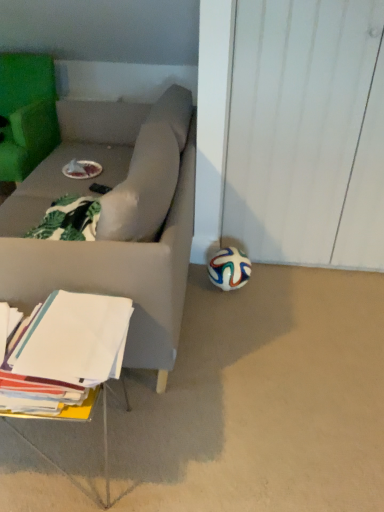
Describe the element at coordinates (261, 400) in the screenshot. I see `white matte soccer ball at lower right` at that location.

The width and height of the screenshot is (384, 512). Describe the element at coordinates (229, 269) in the screenshot. I see `multicolored rubber ball at lower right` at that location.

The width and height of the screenshot is (384, 512). What are the coordinates of `green fabric chair at upper left` in the screenshot? It's located at (26, 113).

Describe the element at coordinates (66, 357) in the screenshot. This screenshot has height=512, width=384. I see `white paper at lower left` at that location.

Locate an element on the screen. The width and height of the screenshot is (384, 512). white matte soccer ball at lower right is located at coordinates (261, 400).

Is the surface of green fabric chair at upper left in direct contact with multicolored rubber ball at lower right?

No, green fabric chair at upper left is not touching multicolored rubber ball at lower right.

Is green fabric chair at upper left wider or thinner than multicolored rubber ball at lower right?

In the image, green fabric chair at upper left appears to be wider than multicolored rubber ball at lower right.

Considering the positions of point (15, 111) and point (210, 264), is point (15, 111) closer or farther from the camera than point (210, 264)?

Point (15, 111) appears to be farther away from the viewer than point (210, 264).

From the image's perspective, is green fabric chair at upper left located above or below multicolored rubber ball at lower right?

green fabric chair at upper left is above multicolored rubber ball at lower right.

Is multicolored rubber ball at lower right placed right next to green fabric chair at upper left?

No, multicolored rubber ball at lower right is not touching green fabric chair at upper left.

Is multicolored rubber ball at lower right smaller than green fabric chair at upper left?

Yes, multicolored rubber ball at lower right is smaller than green fabric chair at upper left.

From their relative heights in the image, would you say multicolored rubber ball at lower right is taller or shorter than green fabric chair at upper left?

In the image, multicolored rubber ball at lower right appears to be shorter than green fabric chair at upper left.

This screenshot has width=384, height=512. What are the coordinates of `chair above the multicolored rubber ball at lower right (from a real-world perspective)` in the screenshot? It's located at (26, 113).

Would you say multicolored rubber ball at lower right is a long distance from white matte soccer ball at lower right?

No, multicolored rubber ball at lower right is in close proximity to white matte soccer ball at lower right.

Does multicolored rubber ball at lower right lie in front of white matte soccer ball at lower right?

No, multicolored rubber ball at lower right is behind white matte soccer ball at lower right.

Is multicolored rubber ball at lower right located outside white matte soccer ball at lower right?

Absolutely, multicolored rubber ball at lower right is external to white matte soccer ball at lower right.

Who is bigger, multicolored rubber ball at lower right or white matte soccer ball at lower right?

white matte soccer ball at lower right.

I want to click on ball on the right of the white paper at lower left, so click(x=229, y=269).

Based on the photo, considering the sizes of objects white paper at lower left and multicolored rubber ball at lower right in the image provided, who is shorter, white paper at lower left or multicolored rubber ball at lower right?

With less height is multicolored rubber ball at lower right.

Would you say white paper at lower left is outside multicolored rubber ball at lower right?

Yes, white paper at lower left is not within multicolored rubber ball at lower right.

Considering the points (30, 335) and (222, 256), which point is in front, point (30, 335) or point (222, 256)?

Point (30, 335)

From the image's perspective, between green fabric chair at upper left and white matte soccer ball at lower right, which one is located above?

green fabric chair at upper left.

Is green fabric chair at upper left located outside white matte soccer ball at lower right?

Indeed, green fabric chair at upper left is completely outside white matte soccer ball at lower right.

Does point (33, 102) appear closer or farther from the camera than point (68, 432)?

Point (33, 102) appears to be farther away from the viewer than point (68, 432).

From a real-world perspective, who is located lower, white paper at lower left or green fabric chair at upper left?

white paper at lower left.

Is white paper at lower left shorter than green fabric chair at upper left?

Yes, white paper at lower left is shorter than green fabric chair at upper left.

Is white paper at lower left wider than green fabric chair at upper left?

In fact, white paper at lower left might be narrower than green fabric chair at upper left.

From the picture: Is white matte soccer ball at lower right to the left of white paper at lower left from the viewer's perspective?

No, white matte soccer ball at lower right is not to the left of white paper at lower left.

Are white matte soccer ball at lower right and white paper at lower left beside each other?

No, white matte soccer ball at lower right is not making contact with white paper at lower left.

Can you confirm if white matte soccer ball at lower right is wider than white paper at lower left?

Indeed, white matte soccer ball at lower right has a greater width compared to white paper at lower left.

Find the location of a particular element. ball below the green fabric chair at upper left (from a real-world perspective) is located at coordinates (229, 269).

Where is `chair that is behind the multicolored rubber ball at lower right`? Image resolution: width=384 pixels, height=512 pixels. chair that is behind the multicolored rubber ball at lower right is located at coordinates (26, 113).

Based on their spatial positions, is white matte soccer ball at lower right or white paper at lower left closer to multicolored rubber ball at lower right?

The object closer to multicolored rubber ball at lower right is white matte soccer ball at lower right.

Based on the photo, estimate the real-world distances between objects in this image. Which object is closer to multicolored rubber ball at lower right, white paper at lower left or white matte soccer ball at lower right?

Based on the image, white matte soccer ball at lower right appears to be nearer to multicolored rubber ball at lower right.

Looking at the image, which one is located further to white paper at lower left, green fabric chair at upper left or white matte soccer ball at lower right?

green fabric chair at upper left is positioned further to the anchor white paper at lower left.

Based on their spatial positions, is white paper at lower left or multicolored rubber ball at lower right closer to white matte soccer ball at lower right?

Among the two, white paper at lower left is located nearer to white matte soccer ball at lower right.

Based on their spatial positions, is white matte soccer ball at lower right or white paper at lower left closer to green fabric chair at upper left?

white paper at lower left.

Looking at the image, which one is located further to green fabric chair at upper left, multicolored rubber ball at lower right or white matte soccer ball at lower right?

white matte soccer ball at lower right is further to green fabric chair at upper left.

Estimate the real-world distances between objects in this image. Which object is closer to green fabric chair at upper left, white matte soccer ball at lower right or multicolored rubber ball at lower right?

multicolored rubber ball at lower right.

Looking at the image, which one is located closer to white paper at lower left, multicolored rubber ball at lower right or white matte soccer ball at lower right?

white matte soccer ball at lower right lies closer to white paper at lower left than the other object.

Find the location of a particular element. The height and width of the screenshot is (512, 384). concrete between green fabric chair at upper left and white paper at lower left in the up-down direction is located at coordinates (261, 400).

This screenshot has width=384, height=512. In order to click on concrete between white paper at lower left and multicolored rubber ball at lower right along the z-axis in this screenshot , I will do `click(261, 400)`.

In order to click on concrete between green fabric chair at upper left and multicolored rubber ball at lower right in this screenshot , I will do `click(261, 400)`.

This screenshot has width=384, height=512. I want to click on table located between green fabric chair at upper left and multicolored rubber ball at lower right in the left-right direction, so click(66, 357).